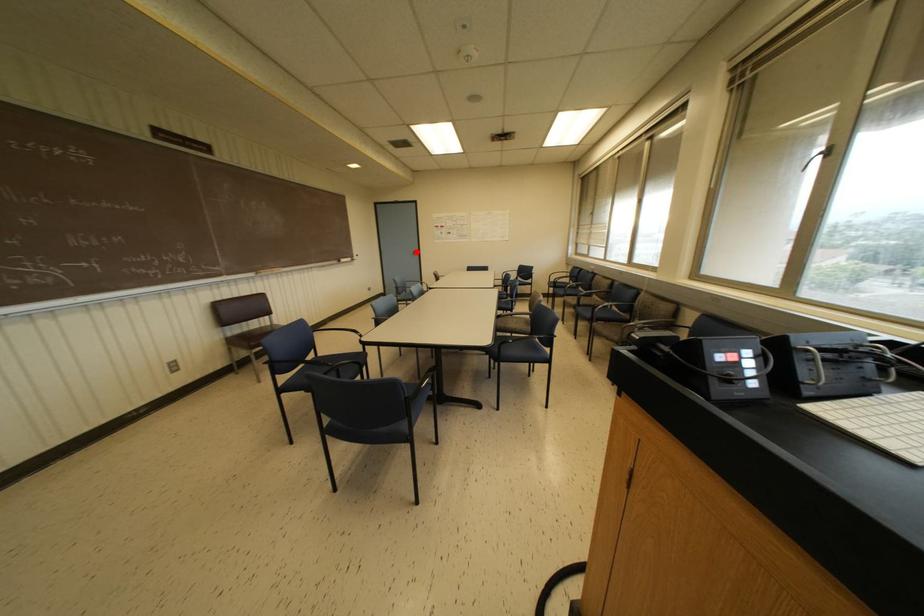
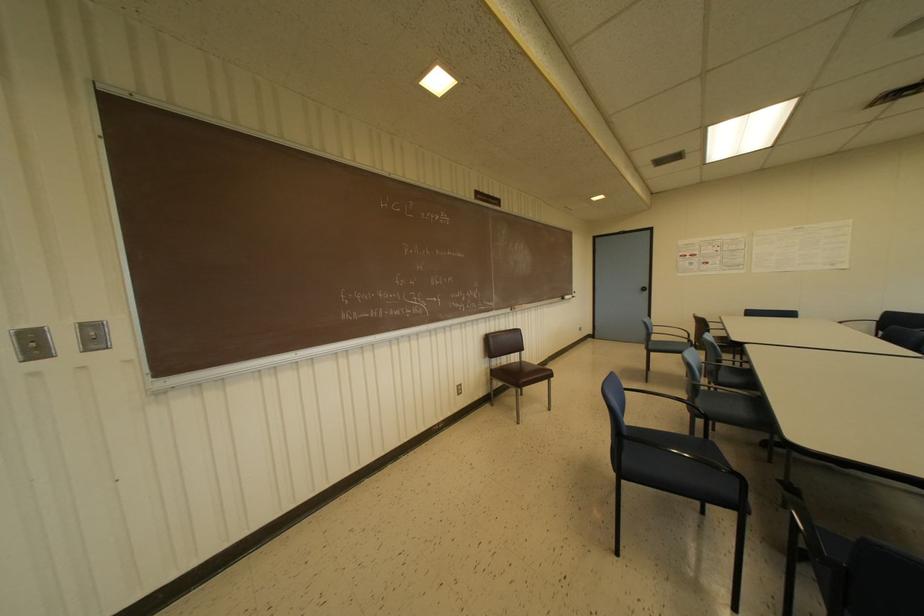
Question: A red point is marked in image1. In image2, is the corresponding 3D point closer to the camera or farther? Reply with the corresponding letter.

Choices:
 (A) The corresponding 3D point is closer.
 (B) The corresponding 3D point is farther.

Answer: (B)